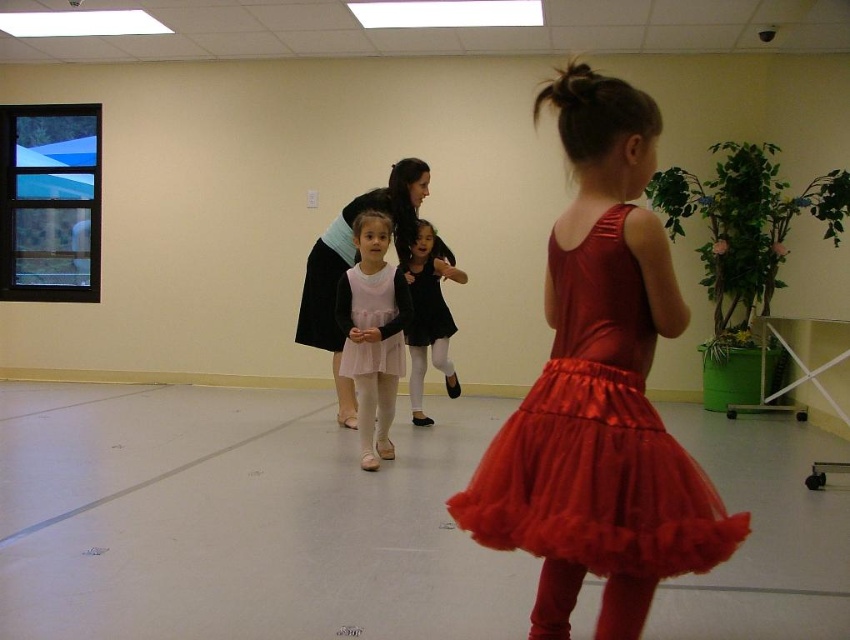
Does pink satin tutu at center appear over black satin dress at center?

No.

Which is in front, point (353, 340) or point (425, 339)?

Point (353, 340) is in front.

Does point (384, 387) come closer to viewer compared to point (428, 300)?

Yes.

Image resolution: width=850 pixels, height=640 pixels. What are the coordinates of `pink satin tutu at center` in the screenshot? It's located at (374, 333).

Who is more distant from viewer, (x=420, y=179) or (x=423, y=225)?

The point (x=423, y=225) is behind.

Does pink satin dress at center have a greater width compared to black satin dress at center?

Yes, pink satin dress at center is wider than black satin dress at center.

Who is more forward, (350, 419) or (439, 284)?

Point (350, 419) is more forward.

You are a GUI agent. You are given a task and a screenshot of the screen. Output one action in this format:
    pyautogui.click(x=<x>, y=<y>)
    Task: Click on the pink satin dress at center
    This screenshot has width=850, height=640.
    Given the screenshot: What is the action you would take?
    pyautogui.click(x=352, y=264)

Image resolution: width=850 pixels, height=640 pixels. Describe the element at coordinates (596, 438) in the screenshot. I see `shiny red tulle skirt at center` at that location.

Locate an element on the screen. shiny red tulle skirt at center is located at coordinates (596, 438).

I want to click on shiny red tulle skirt at center, so click(x=596, y=438).